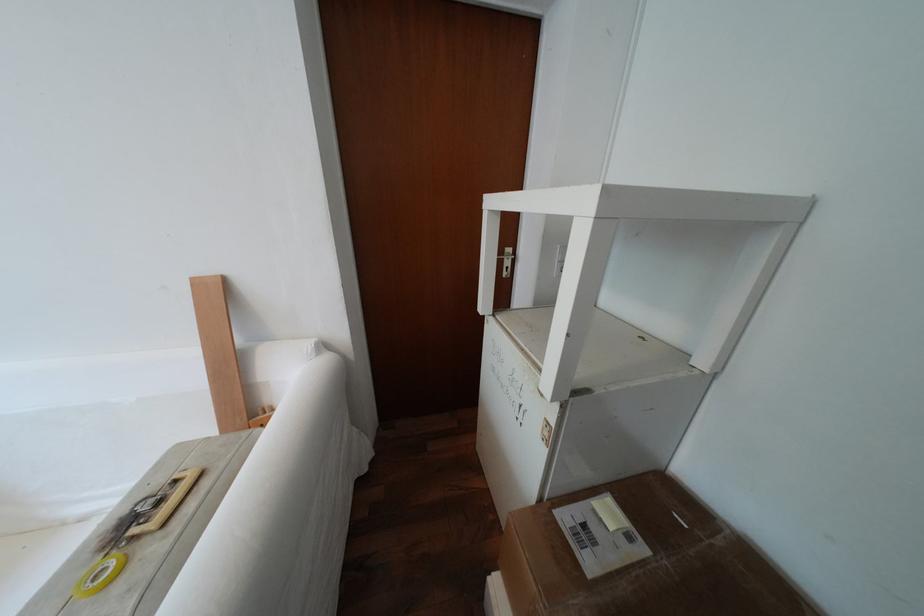
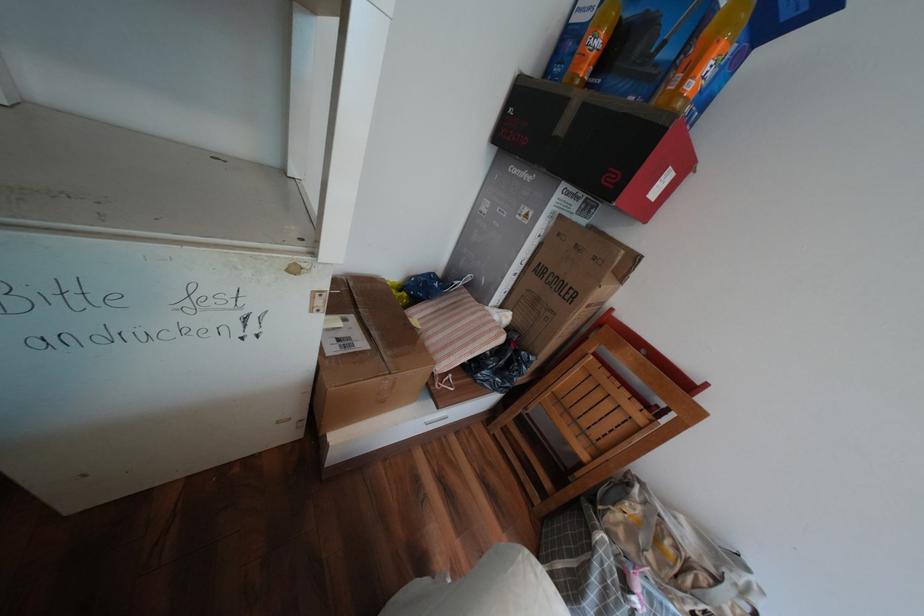
The images are taken continuously from a first-person perspective. In which direction is your viewpoint rotating?

The camera rotated toward right-down.